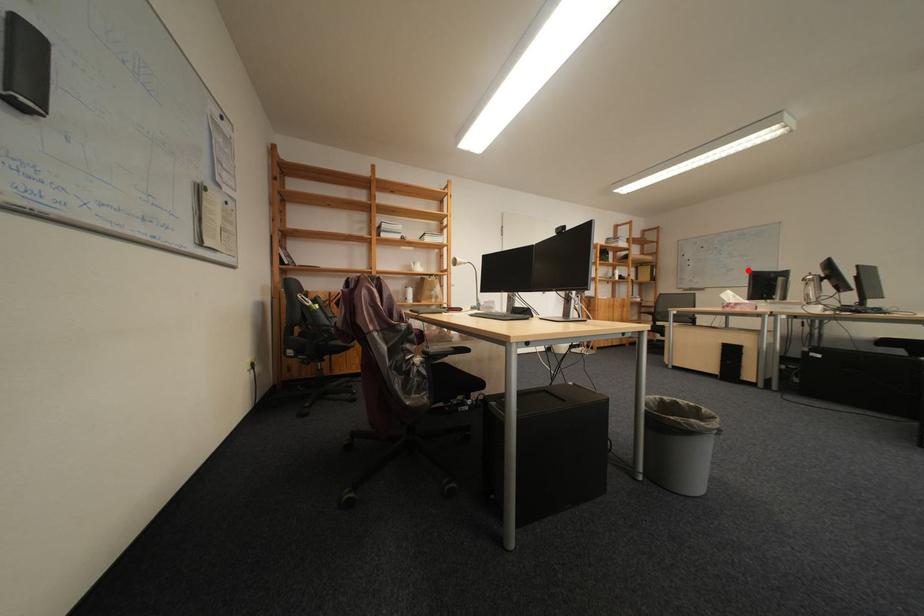
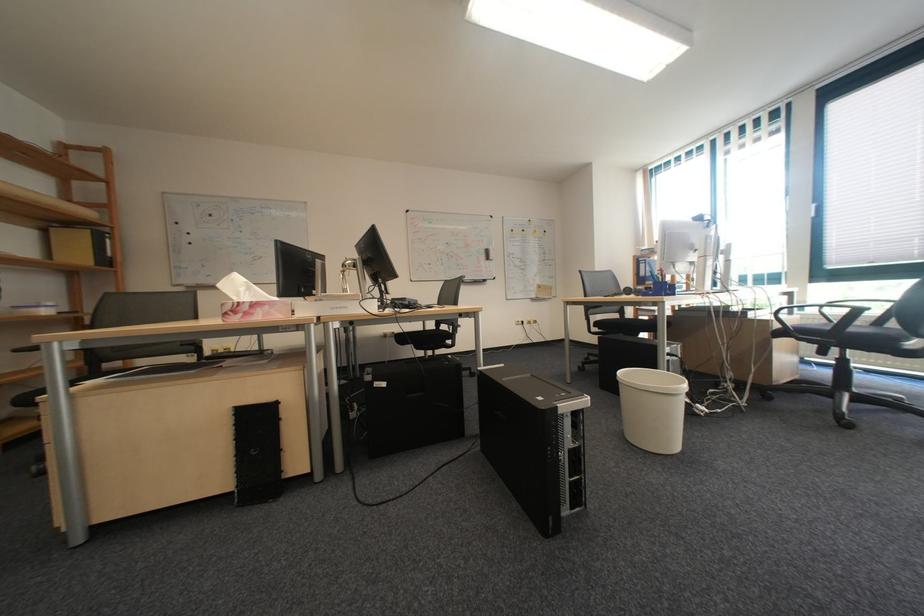
Find the pixel in the second image that matches the highlighted location in the first image.

(275, 257)